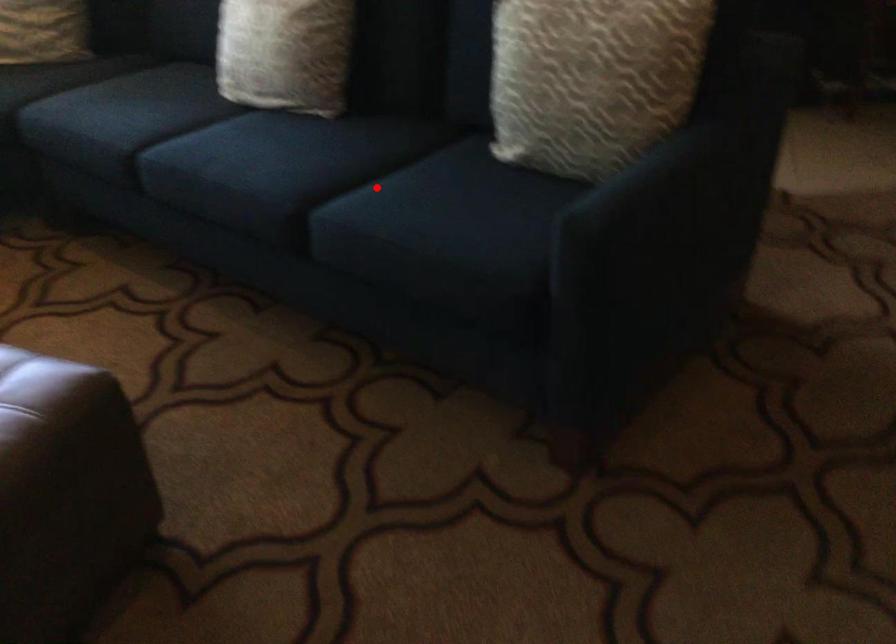
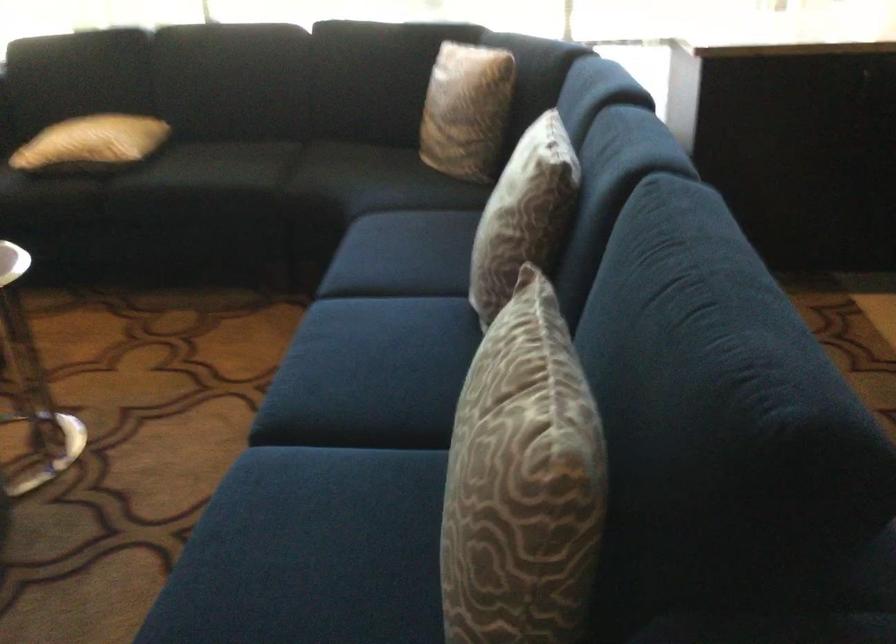
The point at the highlighted location is marked in the first image. Where is the corresponding point in the second image?

(341, 458)